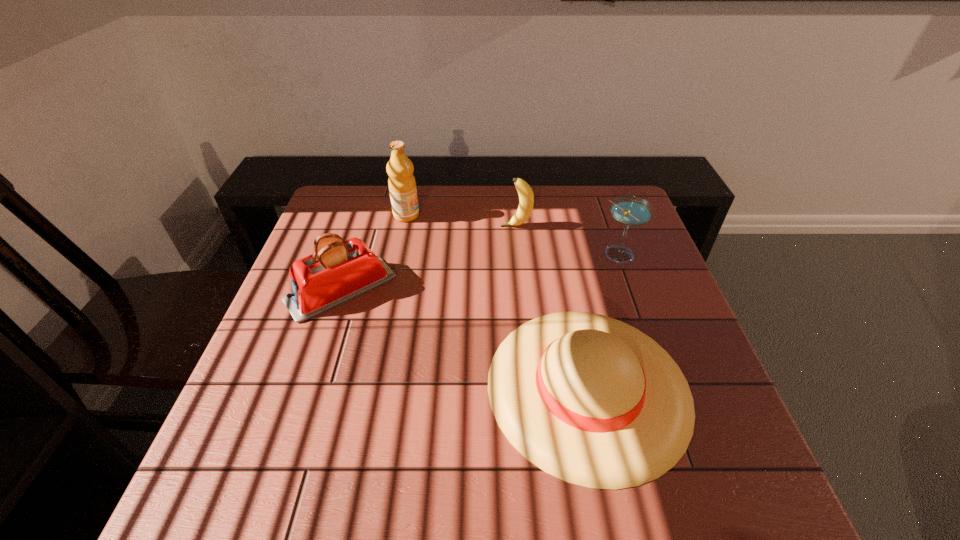
At what (x,y) coordinates should I click in order to perform the action: click on vacant region between the toaster and the martini. Please return your answer as a coordinate pair (x, y). The image size is (960, 540). Looking at the image, I should click on (480, 272).

Find the location of a particular element. free space between the banana and the tallest object is located at coordinates (461, 221).

Locate an element on the screen. free space between the martini and the tallest object is located at coordinates (513, 235).

Identify the location of unoccupied area between the toaster and the banana. (428, 258).

Find the location of a particular element. This screenshot has width=960, height=540. unoccupied position between the banana and the sombrero is located at coordinates (552, 306).

The height and width of the screenshot is (540, 960). I want to click on empty location between the fruit juice and the martini, so click(x=513, y=235).

The height and width of the screenshot is (540, 960). Identify the location of object identified as the closest to the tallest object. (338, 271).

Point out which object is positioned as the nearest to the martini. Please provide its 2D coordinates. Your answer should be formatted as a tuple, i.e. [(x, y)], where the tuple contains the x and y coordinates of a point satisfying the conditions above.

[(589, 399)]

At what (x,y) coordinates should I click in order to perform the action: click on vacant region that satisfies the following two spatial constraints: 1. from the stem of the banana; 2. on the left side of the sombrero. Please return your answer as a coordinate pair (x, y). The image size is (960, 540). Looking at the image, I should click on (532, 387).

Locate an element on the screen. vacant space that satisfies the following two spatial constraints: 1. on the front label of the fruit juice; 2. on the back side of the martini is located at coordinates (398, 255).